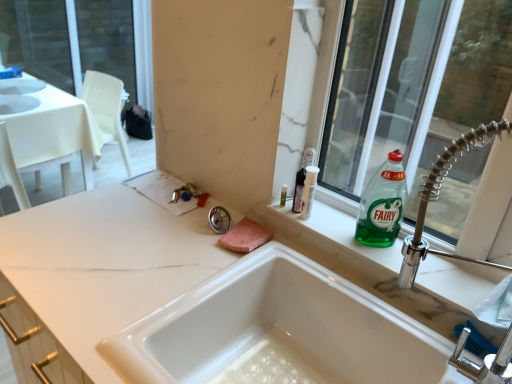
The width and height of the screenshot is (512, 384). Identify the location of vacant space in between translucent plastic bottle at upper right and green glass bottle at upper right. (326, 224).